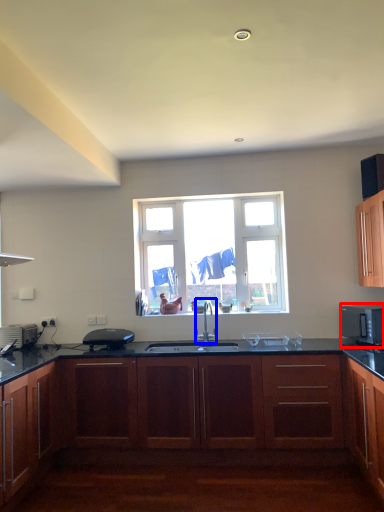
Question: Which object appears farthest to the camera in this image, microwave oven (highlighted by a red box) or tap (highlighted by a blue box)?

Choices:
 (A) microwave oven
 (B) tap

Answer: (B)